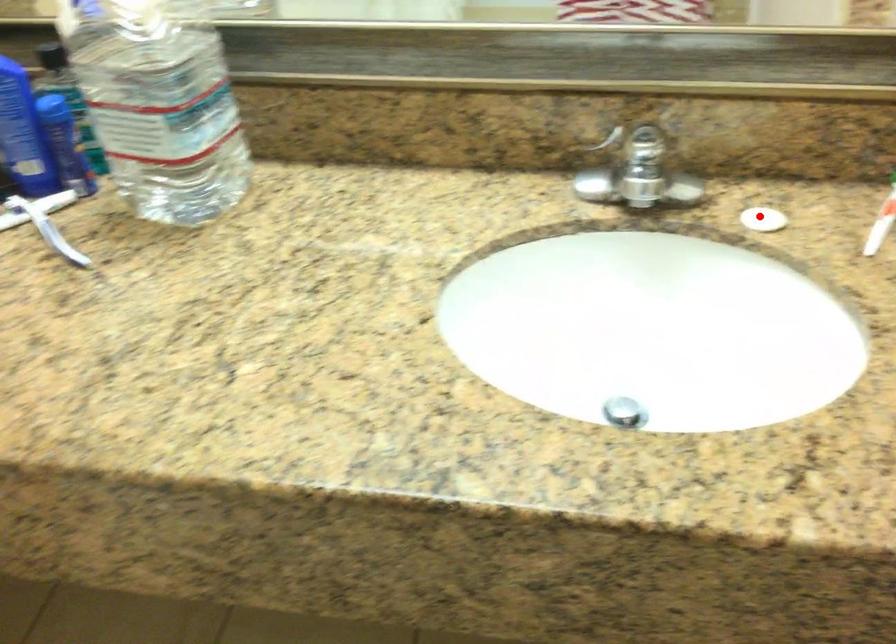
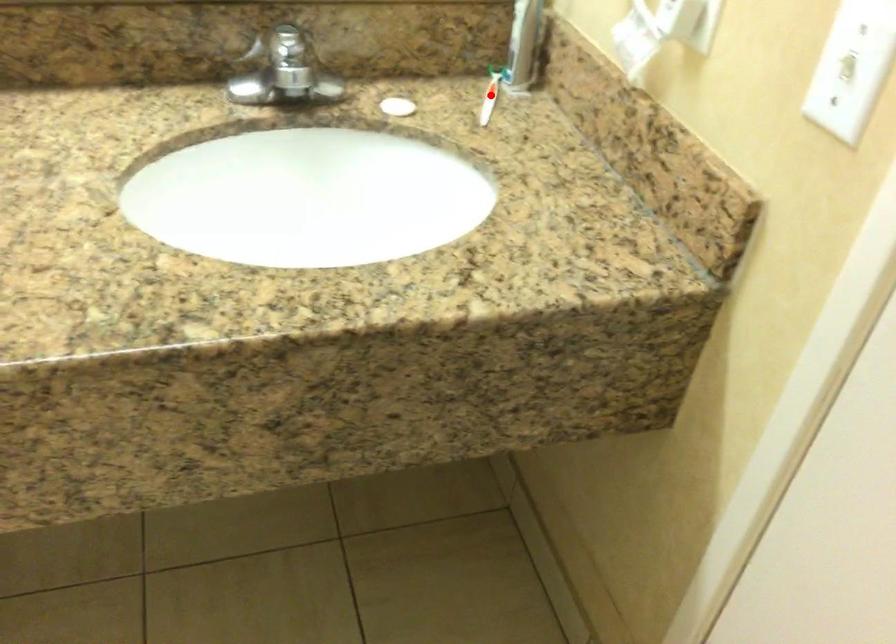
I am providing you with two images of the same scene from different viewpoints. A red point is marked on the first image and another point is marked on the second image. Is the marked point in image1 the same physical position as the marked point in image2?

No